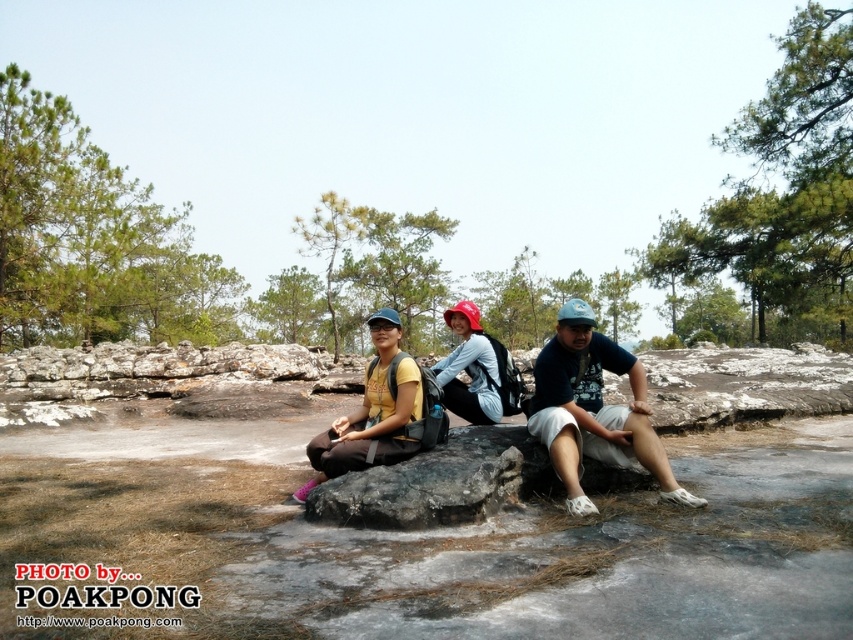
You are a hiker who wants to place a 36 inch long backpack between the gray rough boulder at center and the light blue fabric at center. Can the backpack fit in the space between them?

The distance between the gray rough boulder at center and the light blue fabric at center is 37.26 inches. Since the backpack is 36 inches long, it can fit in the space between them as there is enough room.

You are a photographer planning to take a photo of the gray rough boulder at center and the light blue fabric at center. Which object should you focus on first to ensure both are in sharp focus?

You should focus on the gray rough boulder at center first because it is closer to the viewer than the light blue fabric at center, ensuring both will be in focus when using a proper depth of field.